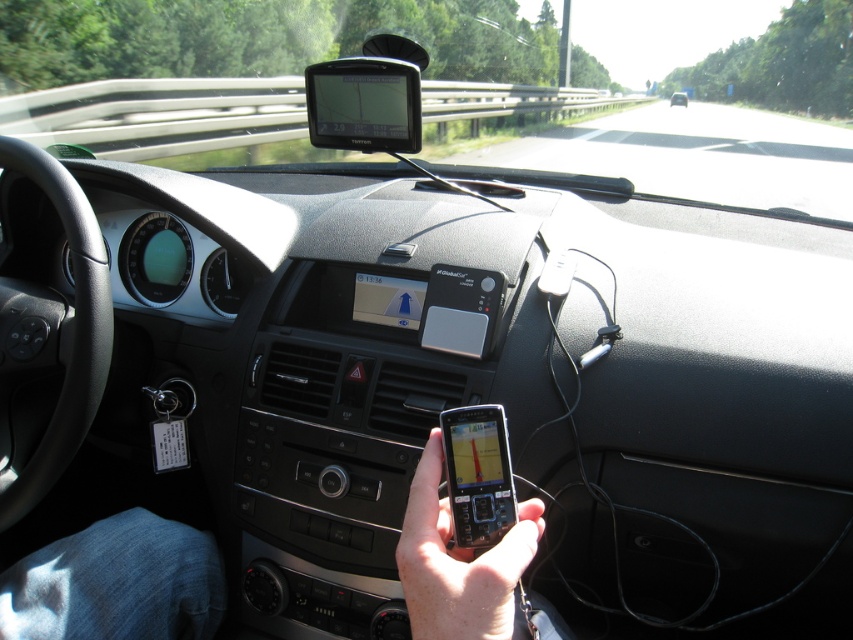
You are a passenger in the car and want to use your phone, which is the smooth black phone at center. However, there is another black plastic phone at center blocking it. Can you reach your phone without moving the other phone?

The smooth black phone at center is positioned under the black plastic phone at center, so you can reach it by lifting the other phone first or accessing it from below.

You are driving and need to check both devices on the dashboard. Which device should you glance at first to minimize taking your eyes off the road, the black plastic phone at center or the matte black phone at center?

You should glance at the black plastic phone at center first because it is located to the left of the matte black phone at center, allowing you to check it without turning your head as far to the right.